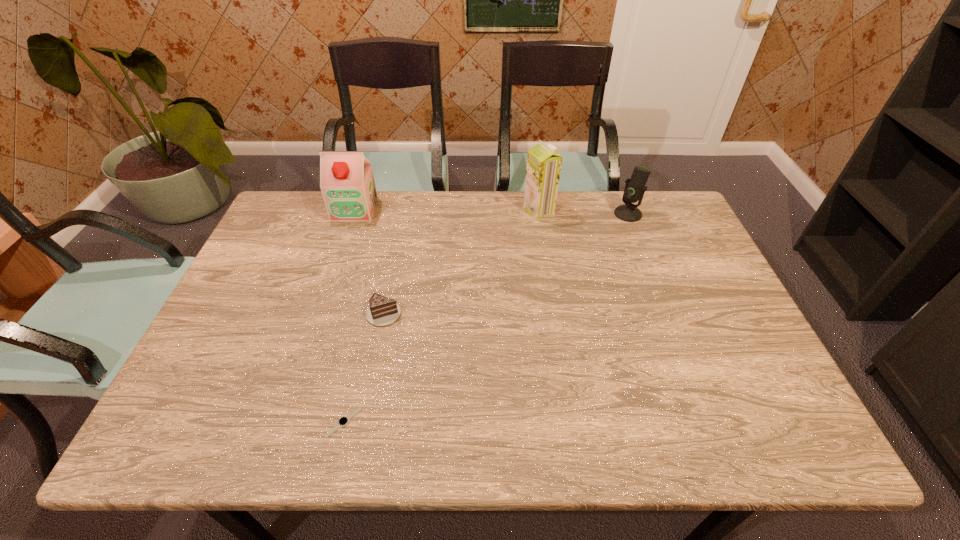
Image resolution: width=960 pixels, height=540 pixels. What are the coordinates of `free point between the watch and the second object from right to left` in the screenshot? It's located at (442, 316).

Find the location of a particular element. The height and width of the screenshot is (540, 960). empty space that is in between the leftmost object and the second object from right to left is located at coordinates (446, 210).

Select which object is the third closest to the chocolate cake. Please provide its 2D coordinates. Your answer should be formatted as a tuple, i.e. [(x, y)], where the tuple contains the x and y coordinates of a point satisfying the conditions above.

[(544, 163)]

Select which object is the closest to the nearest object. Please provide its 2D coordinates. Your answer should be formatted as a tuple, i.e. [(x, y)], where the tuple contains the x and y coordinates of a point satisfying the conditions above.

[(382, 311)]

In order to click on blank space that satisfies the following two spatial constraints: 1. on the back side of the fourth object from left to right; 2. on the left side of the fourth farthest object in this screenshot , I will do `click(404, 210)`.

At what (x,y) coordinates should I click in order to perform the action: click on vacant area that satisfies the following two spatial constraints: 1. on the back side of the rightmost object; 2. on the right side of the second nearest object. Please return your answer as a coordinate pair (x, y). The width and height of the screenshot is (960, 540). Looking at the image, I should click on (404, 214).

Image resolution: width=960 pixels, height=540 pixels. In order to click on vacant point that satisfies the following two spatial constraints: 1. on the back side of the nearest object; 2. on the left side of the fourth object from left to right in this screenshot , I will do `click(393, 210)`.

You are a GUI agent. You are given a task and a screenshot of the screen. Output one action in this format:
    pyautogui.click(x=<x>, y=<y>)
    Task: Click on the free space that satisfies the following two spatial constraints: 1. with the cap open on the leftmost object; 2. on the right side of the fourth farthest object
    
    Given the screenshot: What is the action you would take?
    pyautogui.click(x=320, y=313)

This screenshot has width=960, height=540. Identify the location of blank space that satisfies the following two spatial constraints: 1. with the cap open on the left soya milk; 2. on the right side of the nearest object. (283, 422).

Identify the location of free space that satisfies the following two spatial constraints: 1. with the cap open on the right soya milk; 2. on the right side of the left soya milk. Image resolution: width=960 pixels, height=540 pixels. (354, 210).